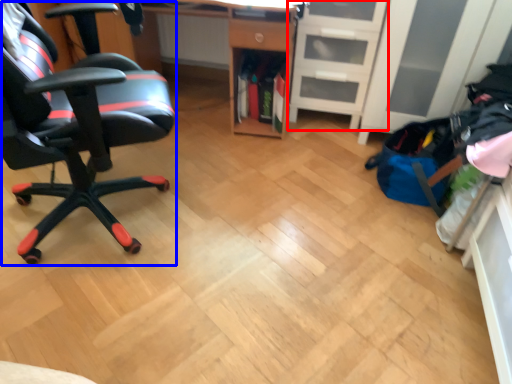
Question: Which object appears closest to the camera in this image, file cabinet (highlighted by a red box) or chair (highlighted by a blue box)?

Choices:
 (A) file cabinet
 (B) chair

Answer: (B)